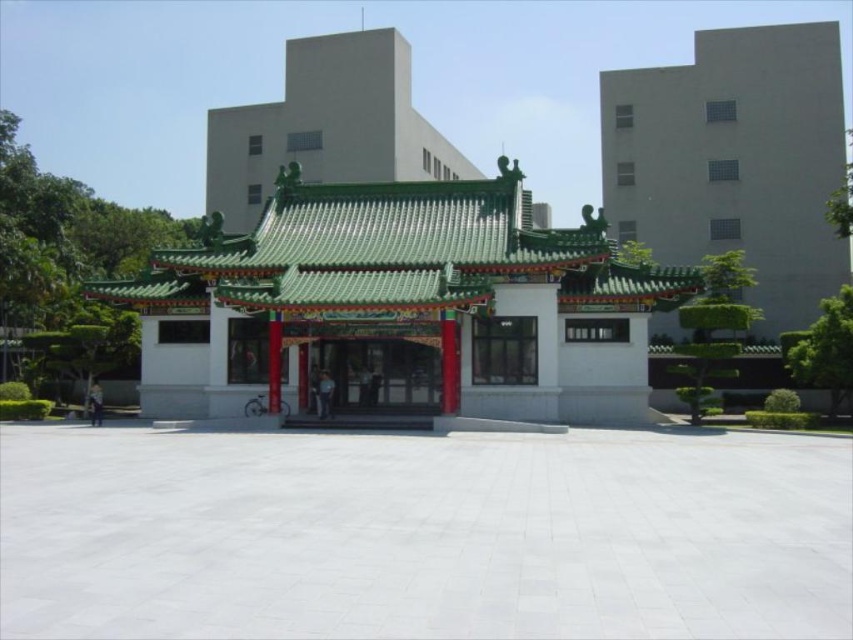
Consider the image. Does green tile roof gazebo at center have a larger size compared to matte red door at center?

Yes.

Measure the distance between green tile roof gazebo at center and camera.

23.63 meters

Who is more distant from viewer, (363, 266) or (372, 410)?

The point (372, 410) is more distant.

This screenshot has height=640, width=853. I want to click on green tile roof gazebo at center, so click(401, 305).

Find the location of a particular element. This screenshot has width=853, height=640. green tile roof gazebo at center is located at coordinates (401, 305).

Between point (480, 339) and point (770, 64), which one is positioned behind?

The point (770, 64) is more distant.

Where is `green tile roof gazebo at center`? green tile roof gazebo at center is located at coordinates (401, 305).

The height and width of the screenshot is (640, 853). Find the location of `smooth concrete building at upper right`. smooth concrete building at upper right is located at coordinates (734, 161).

Is point (820, 196) less distant than point (328, 365)?

No, (820, 196) is further to viewer.

Is point (776, 49) closer to camera compared to point (347, 340)?

No, (776, 49) is further to viewer.

Find the location of a particular element. The width and height of the screenshot is (853, 640). smooth concrete building at upper right is located at coordinates (734, 161).